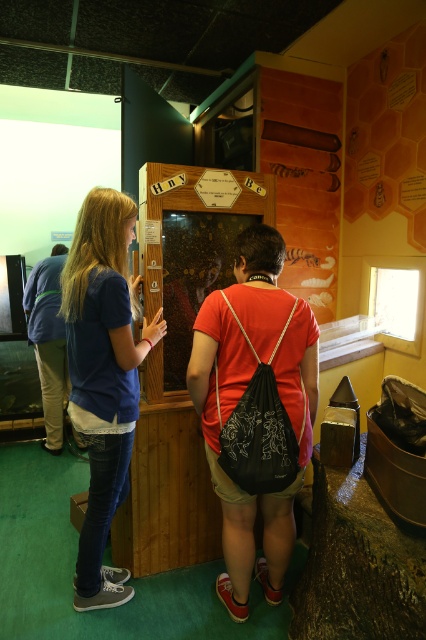
Question: Which point is closer to the camera?

Choices:
 (A) (126, 433)
 (B) (172, 282)

Answer: (A)

Question: Can you confirm if blue denim jeans at left is wider than wooden honeycomb display at center?

Choices:
 (A) no
 (B) yes

Answer: (A)

Question: Which object appears farthest from the camera in this image?

Choices:
 (A) wooden honeycomb display at center
 (B) blue denim jeans at left

Answer: (A)

Question: Considering the relative positions of blue denim jeans at left and wooden honeycomb display at center in the image provided, where is blue denim jeans at left located with respect to wooden honeycomb display at center?

Choices:
 (A) right
 (B) left

Answer: (B)

Question: Which object appears farthest from the camera in this image?

Choices:
 (A) wooden honeycomb display at center
 (B) blue denim jeans at left

Answer: (A)

Question: Is blue denim jeans at left smaller than wooden honeycomb display at center?

Choices:
 (A) no
 (B) yes

Answer: (A)